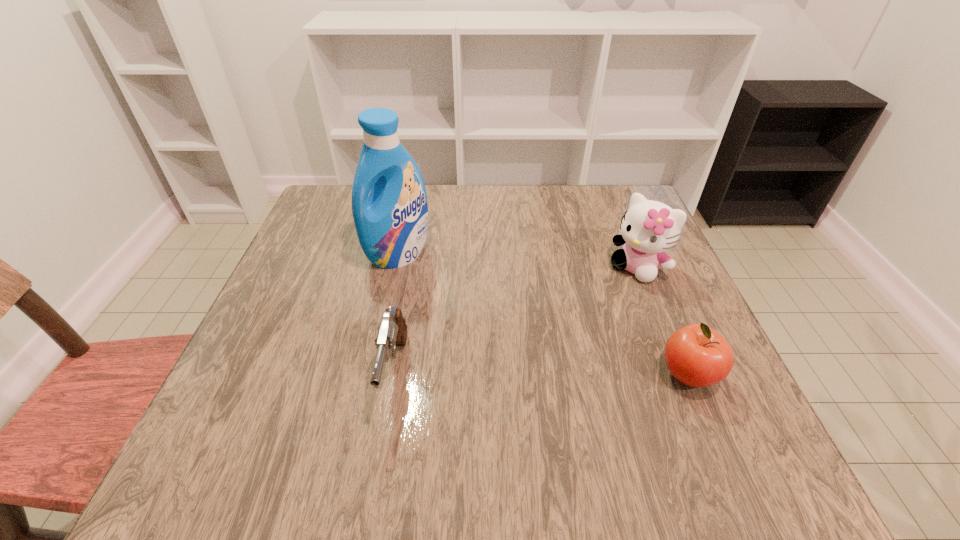
Find the location of a particular element. This screenshot has height=540, width=960. free space on the desktop that is between the pistol and the apple and is positioned on the front-facing side of the tallest object is located at coordinates (534, 373).

Locate an element on the screen. The height and width of the screenshot is (540, 960). vacant space on the desktop that is between the pistol and the apple and is positioned on the front-facing side of the kitten is located at coordinates (526, 373).